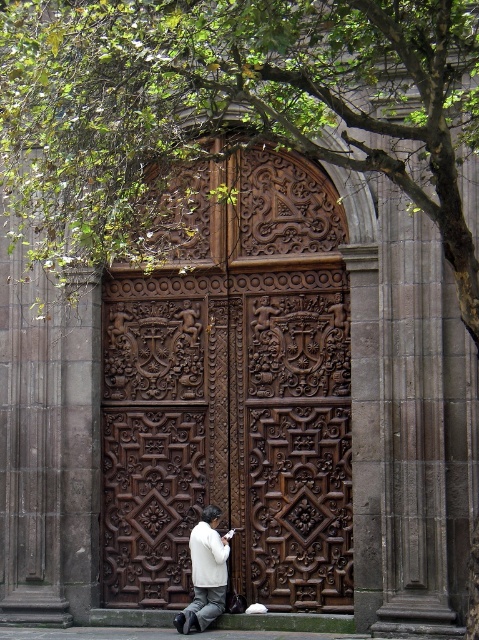
Does dark brown wood at center appear over white matte jacket at lower center?

Correct, dark brown wood at center is located above white matte jacket at lower center.

Who is positioned more to the right, dark brown wood at center or white matte jacket at lower center?

dark brown wood at center

At what (x,y) coordinates should I click in order to perform the action: click on dark brown wood at center. Please return your answer as a coordinate pair (x, y). The height and width of the screenshot is (640, 479). Looking at the image, I should click on (234, 396).